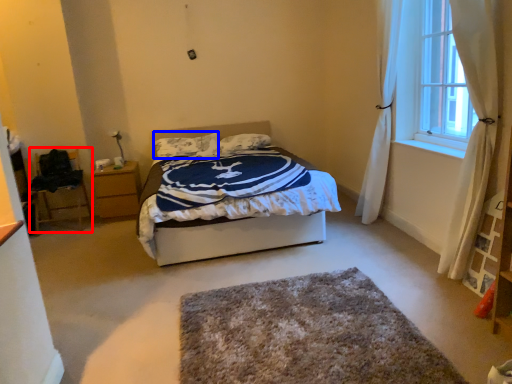
Question: Among these objects, which one is farthest to the camera, furniture (highlighted by a red box) or pillow (highlighted by a blue box)?

Choices:
 (A) furniture
 (B) pillow

Answer: (B)